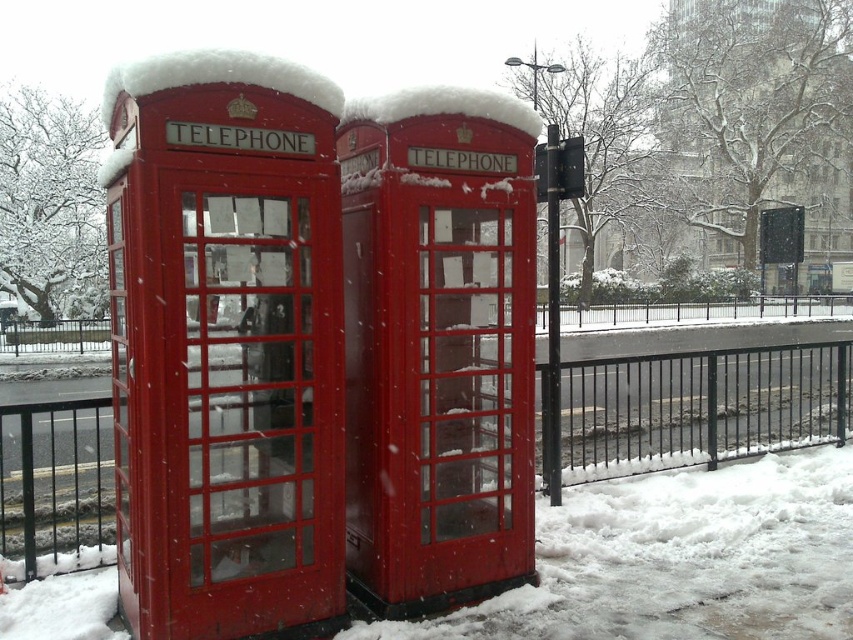
You are standing in a snowy area and want to take a photo of the matte red telephone booth at center and the metallic black fence at lower center. If you position yourself so that the fence is on your right side, which direction should you face to have the telephone booth also in the frame?

Since the matte red telephone booth at center is to the left of the metallic black fence at lower center, you should face to the right to include both the telephone booth and the fence in your photo.